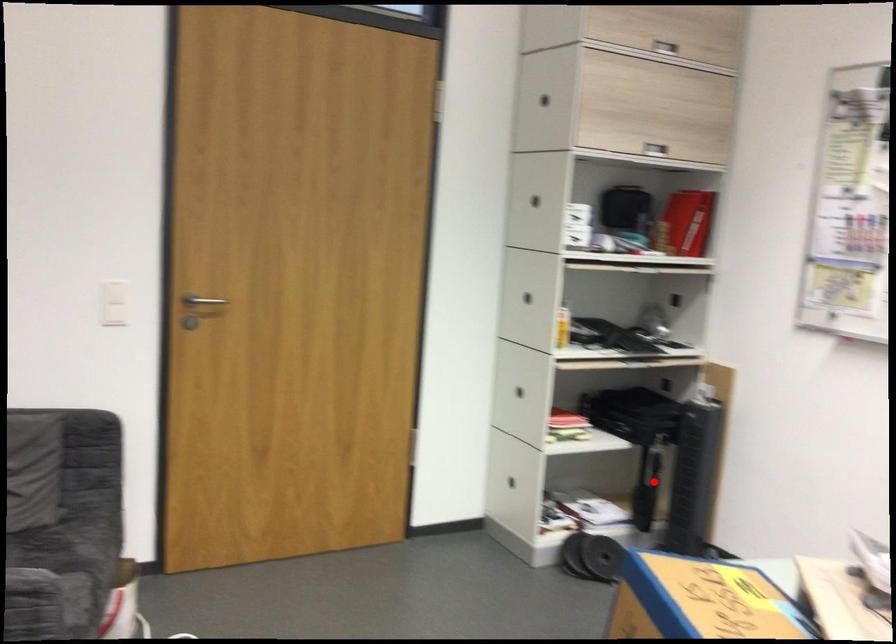
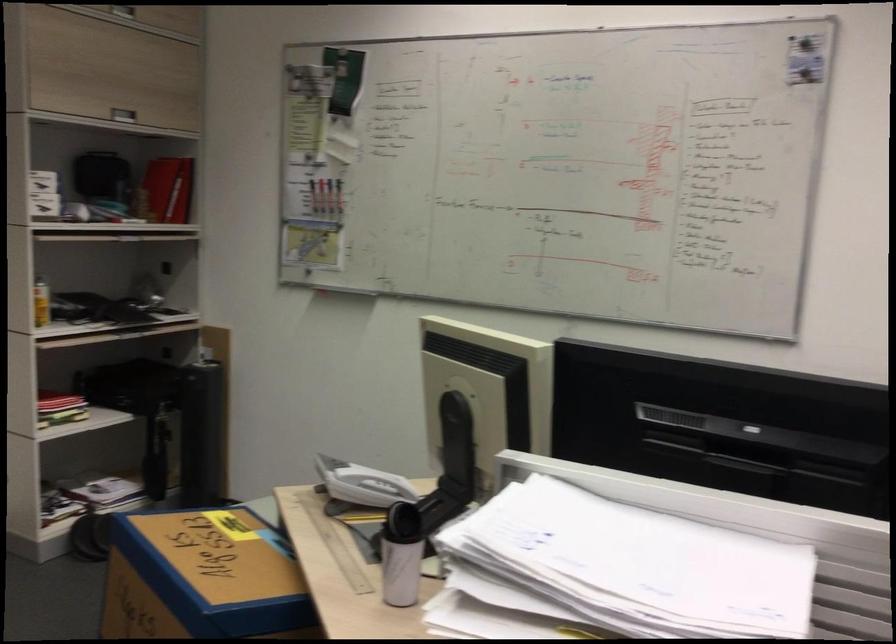
In the second image, find the point that corresponds to the highlighted location in the first image.

(169, 451)